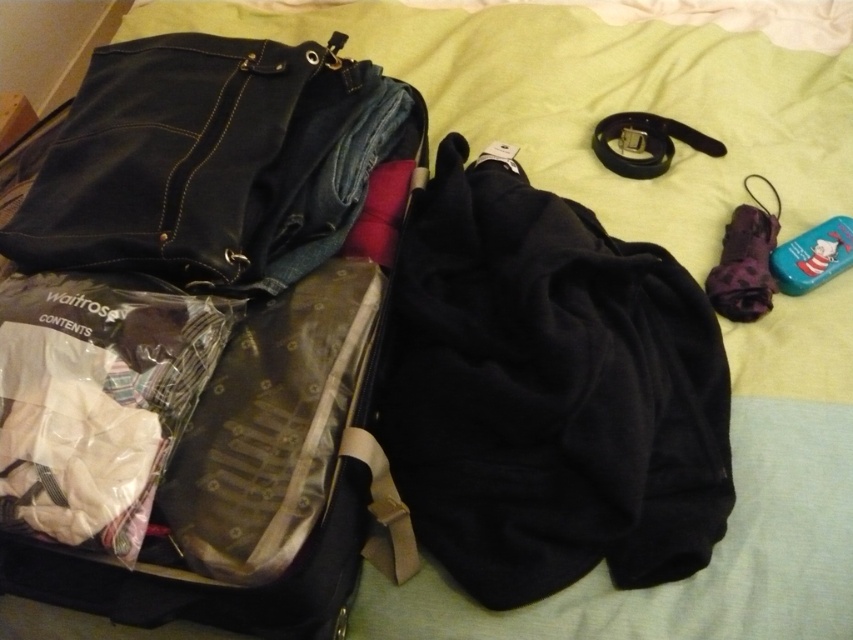
Question: Which point appears closest to the camera in this image?

Choices:
 (A) (520, 298)
 (B) (230, 330)

Answer: (B)

Question: Which point is farther to the camera?

Choices:
 (A) (387, 348)
 (B) (190, 520)

Answer: (A)

Question: Does denim fabric suitcase at left appear under black fleece jacket at center?

Choices:
 (A) yes
 (B) no

Answer: (B)

Question: Where is denim fabric suitcase at left located in relation to black fleece jacket at center in the image?

Choices:
 (A) below
 (B) above

Answer: (B)

Question: Is denim fabric suitcase at left to the right of black fleece jacket at center from the viewer's perspective?

Choices:
 (A) yes
 (B) no

Answer: (B)

Question: Which of the following is the closest to the observer?

Choices:
 (A) denim fabric suitcase at left
 (B) black fleece jacket at center

Answer: (A)